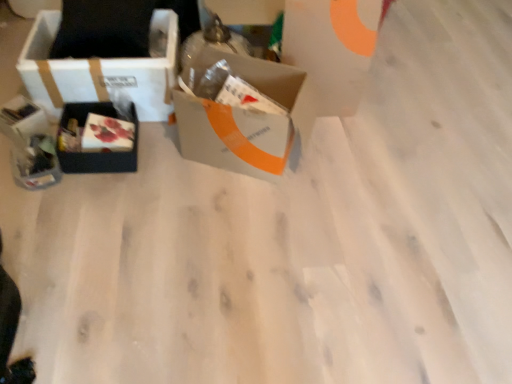
Question: Should I look upward or downward to see gray cardboard box at center, which is counted as the 3th box, starting from the left?

Choices:
 (A) down
 (B) up

Answer: (B)

Question: From the image's perspective, does matte black gift box at left, the second gift box viewed from the top, appear higher than white cardboard box at left, the third box when ordered from right to left?

Choices:
 (A) yes
 (B) no

Answer: (B)

Question: Is the depth of matte black gift box at left, which ranks as the first gift box in bottom-to-top order, less than that of white cardboard box at left, the third box when ordered from right to left?

Choices:
 (A) yes
 (B) no

Answer: (A)

Question: Is matte black gift box at left, the second gift box viewed from the top, at the right side of white cardboard box at left, the third box when ordered from right to left?

Choices:
 (A) no
 (B) yes

Answer: (A)

Question: Considering the relative sizes of matte black gift box at left, the second gift box viewed from the top, and white cardboard box at left, the third box when ordered from right to left, in the image provided, is matte black gift box at left, the second gift box viewed from the top, smaller than white cardboard box at left, the third box when ordered from right to left,?

Choices:
 (A) no
 (B) yes

Answer: (B)

Question: Can you confirm if matte black gift box at left, the second gift box viewed from the top, is taller than white cardboard box at left, the third box when ordered from right to left?

Choices:
 (A) yes
 (B) no

Answer: (B)

Question: Is matte black gift box at left, the second gift box viewed from the top, turned away from white cardboard box at left, the third box when ordered from right to left?

Choices:
 (A) yes
 (B) no

Answer: (B)

Question: Is matte black box at left, which is counted as the second box, starting from the right, next to gray cardboard box at center, which is counted as the 3th box, starting from the left?

Choices:
 (A) yes
 (B) no

Answer: (B)

Question: Does matte black box at left, the second box viewed from the left, appear on the left side of gray cardboard box at center, the first box positioned from the right?

Choices:
 (A) yes
 (B) no

Answer: (A)

Question: Is matte black box at left, the second box viewed from the left, bigger than gray cardboard box at center, which is counted as the 3th box, starting from the left?

Choices:
 (A) yes
 (B) no

Answer: (B)

Question: Is matte black box at left, the second box viewed from the left, at the right side of gray cardboard box at center, the first box positioned from the right?

Choices:
 (A) yes
 (B) no

Answer: (B)

Question: Is matte black box at left, which is counted as the second box, starting from the right, far from gray cardboard box at center, the first box positioned from the right?

Choices:
 (A) no
 (B) yes

Answer: (A)

Question: From the image's perspective, is matte black box at left, which is counted as the second box, starting from the right, beneath gray cardboard box at center, the first box positioned from the right?

Choices:
 (A) yes
 (B) no

Answer: (A)

Question: Does white cardboard box at upper center have a greater height compared to white cardboard box at left, the third box when ordered from right to left?

Choices:
 (A) yes
 (B) no

Answer: (A)